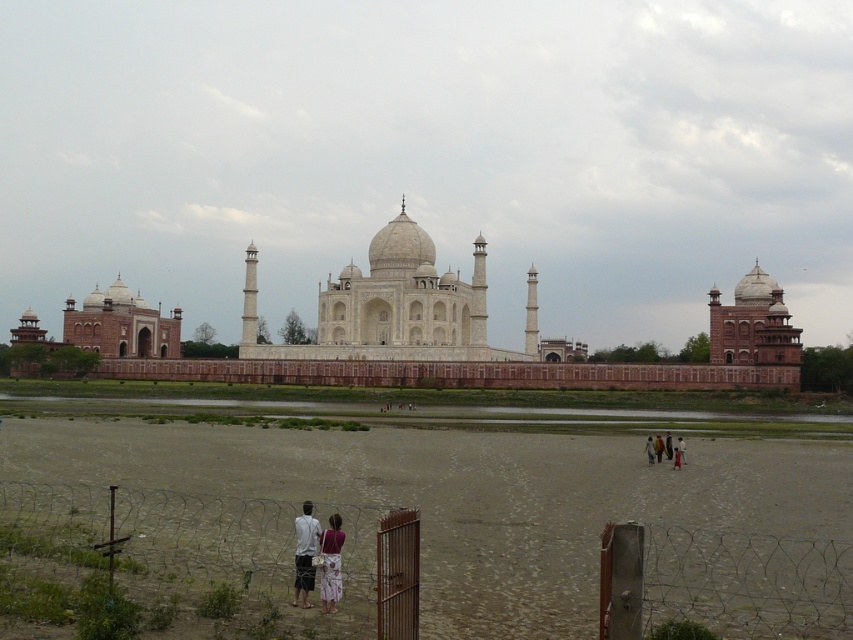
Question: Which point is farther to the camera?

Choices:
 (A) white marble palace at center
 (B) matte white dress at center
 (C) white cotton dress at center
 (D) floral dress at center

Answer: (A)

Question: Does white marble palace at left come in front of floral dress at center?

Choices:
 (A) no
 (B) yes

Answer: (A)

Question: Does matte white dress at center have a lesser width compared to light brown fabric dress at lower right?

Choices:
 (A) yes
 (B) no

Answer: (B)

Question: Which of the following is the farthest from the observer?

Choices:
 (A) (257, 353)
 (B) (682, 438)
 (C) (682, 445)
 (D) (651, 442)

Answer: (A)

Question: Which object appears farthest from the camera in this image?

Choices:
 (A) light brown fabric dress at lower center
 (B) white marble palace at center
 (C) white cotton dress at center
 (D) light brown fabric dress at lower right

Answer: (B)

Question: Does matte white dress at center lie in front of light brown fabric dress at lower center?

Choices:
 (A) no
 (B) yes

Answer: (B)